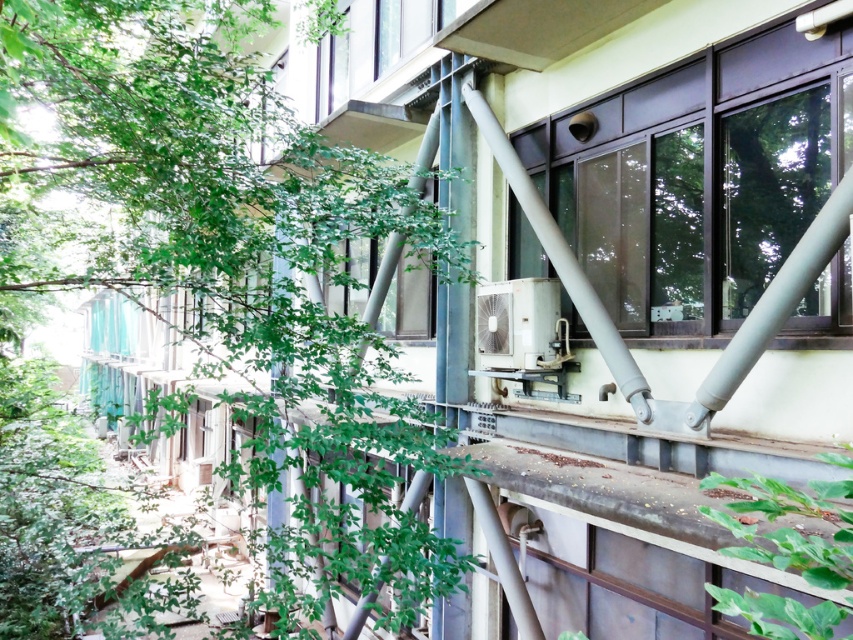
Question: Which of these objects is positioned closest to the metallic gray window at upper right?

Choices:
 (A) clear glass window at center
 (B) green leafy tree at upper left

Answer: (A)

Question: Which of the following is the closest to the observer?

Choices:
 (A) metallic gray window at upper right
 (B) green leafy tree at upper left
 (C) clear glass window at center

Answer: (A)

Question: Does metallic gray window at upper right have a smaller size compared to clear glass window at center?

Choices:
 (A) yes
 (B) no

Answer: (B)

Question: Which object is closer to the camera taking this photo?

Choices:
 (A) green leafy tree at upper left
 (B) clear glass window at center
 (C) metallic gray window at upper right

Answer: (C)

Question: Is metallic gray window at upper right smaller than clear glass window at center?

Choices:
 (A) yes
 (B) no

Answer: (B)

Question: Can you confirm if metallic gray window at upper right is thinner than clear glass window at center?

Choices:
 (A) yes
 (B) no

Answer: (B)